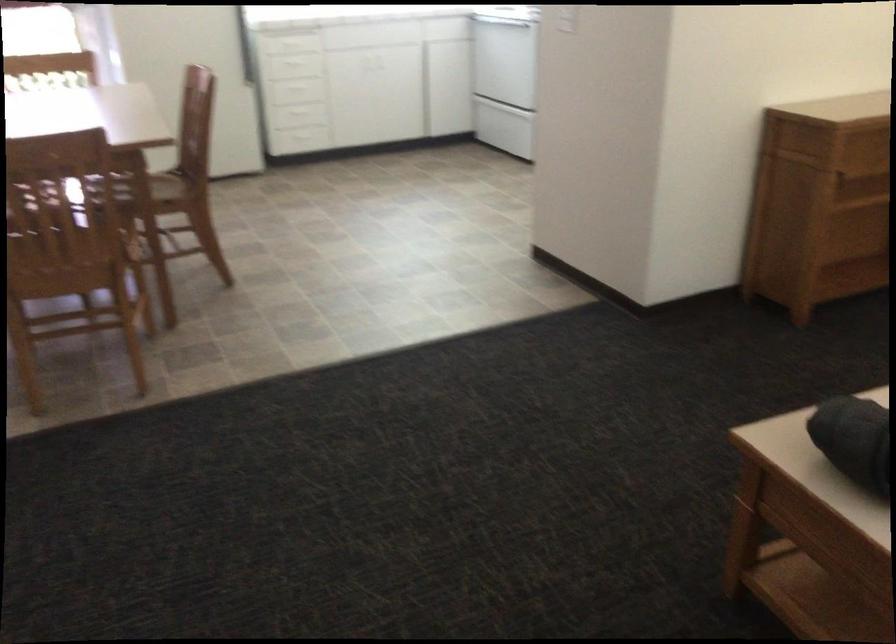
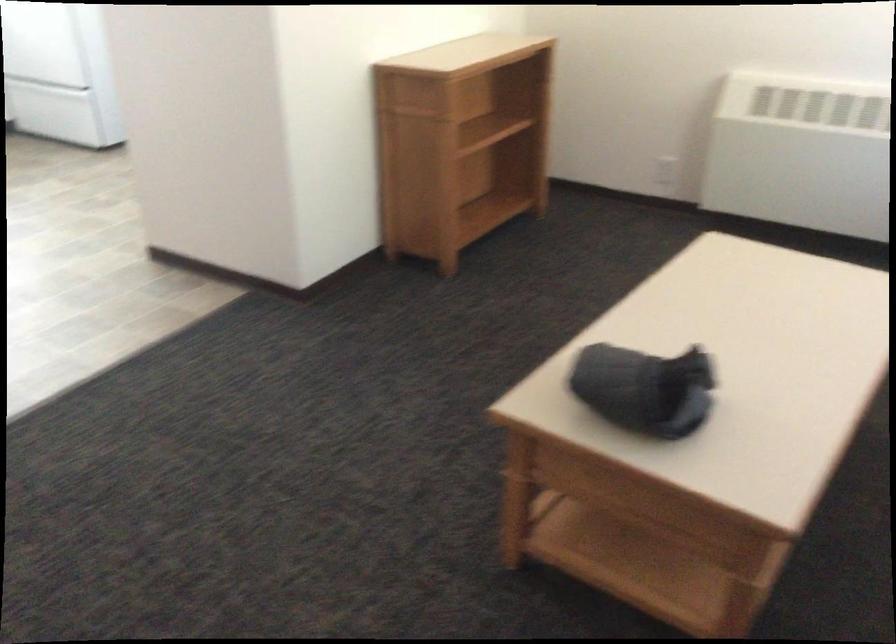
Question: The camera is either moving clockwise (left) or counter-clockwise (right) around the object. The first image is from the beginning of the video and the second image is from the end. Is the camera moving left or right when shooting the video?

Choices:
 (A) Left
 (B) Right

Answer: (A)